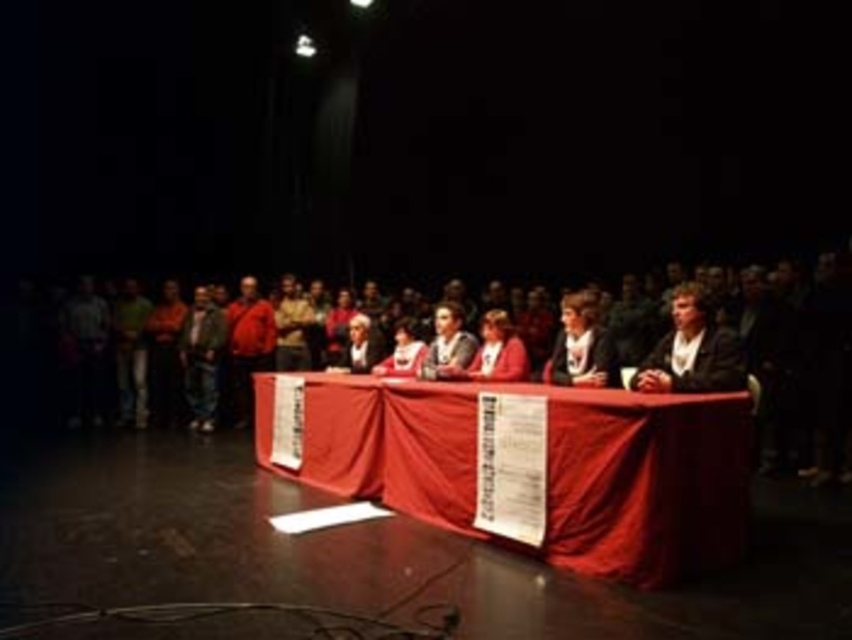
Question: Among these points, which one is nearest to the camera?

Choices:
 (A) (684, 484)
 (B) (599, 304)

Answer: (A)

Question: Can you confirm if matte black crowd at center is positioned to the right of smooth red tablecloth at center?

Choices:
 (A) yes
 (B) no

Answer: (B)

Question: Is matte black crowd at center bigger than smooth red tablecloth at center?

Choices:
 (A) yes
 (B) no

Answer: (A)

Question: Which of the following is the closest to the observer?

Choices:
 (A) (371, 304)
 (B) (566, 492)

Answer: (B)

Question: Can you confirm if matte black crowd at center is positioned to the right of smooth red tablecloth at center?

Choices:
 (A) yes
 (B) no

Answer: (B)

Question: Which of the following is the closest to the observer?

Choices:
 (A) smooth red tablecloth at center
 (B) matte black crowd at center

Answer: (A)